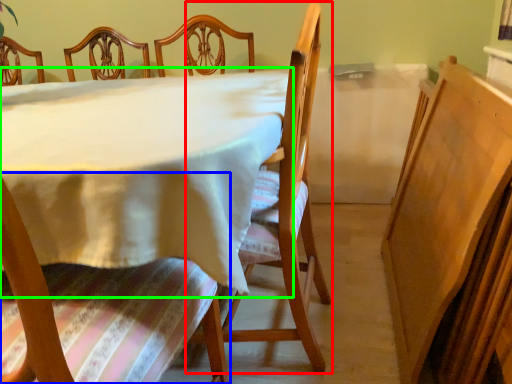
Question: Which object is the farthest from chair (highlighted by a red box)? Choose among these: chair (highlighted by a blue box) or table (highlighted by a green box).

Choices:
 (A) chair
 (B) table

Answer: (A)